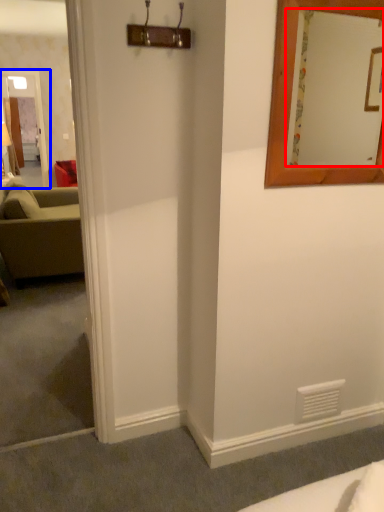
Question: Which object appears farthest to the camera in this image, mirror (highlighted by a red box) or glass door (highlighted by a blue box)?

Choices:
 (A) mirror
 (B) glass door

Answer: (B)